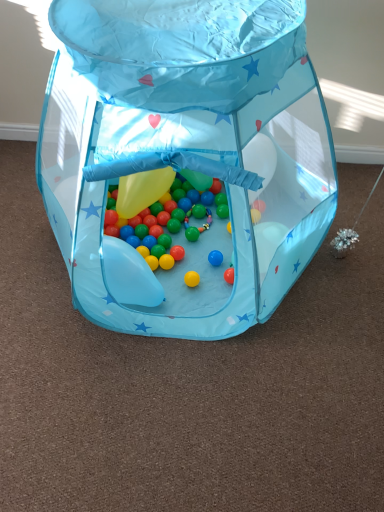
Question: Considering the positions of point (137, 257) and point (221, 197), is point (137, 257) closer or farther from the camera than point (221, 197)?

Choices:
 (A) closer
 (B) farther

Answer: (A)

Question: In terms of width, does translucent plastic balloon at lower left look wider or thinner when compared to shiny plastic beads at center?

Choices:
 (A) wide
 (B) thin

Answer: (B)

Question: Which object is the farthest from the translucent plastic balloon at lower left?

Choices:
 (A) shiny metallic ball at center
 (B) shiny plastic beads at center

Answer: (A)

Question: Which is nearer to the translucent plastic balloon at lower left?

Choices:
 (A) shiny plastic beads at center
 (B) shiny metallic ball at center

Answer: (A)